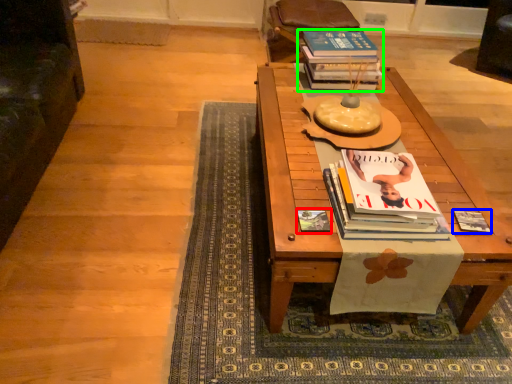
Question: Based on their relative distances, which object is farther from book cover (highlighted by a red box)? Choose from book (highlighted by a blue box) and book (highlighted by a green box).

Choices:
 (A) book
 (B) book

Answer: (B)